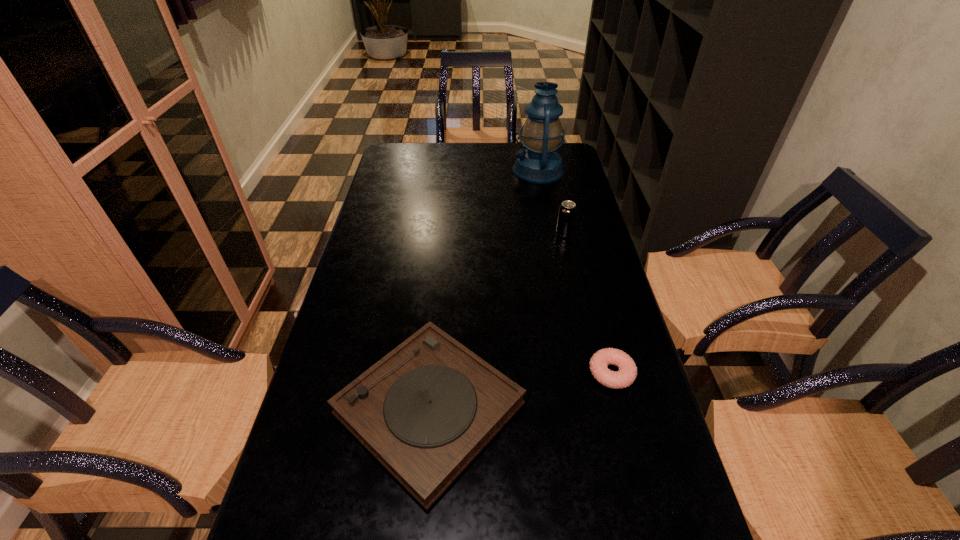
This screenshot has height=540, width=960. In the image, there is a desktop. What are the coordinates of `vacant space at the right edge` in the screenshot? It's located at (585, 245).

This screenshot has height=540, width=960. In the image, there is a desktop. Identify the location of vacant space at the far left corner. (385, 157).

Image resolution: width=960 pixels, height=540 pixels. What are the coordinates of `free space between the doughnut and the farthest object` in the screenshot? It's located at (575, 272).

Find the location of a particular element. free spot between the phonograph record and the third nearest object is located at coordinates (496, 321).

Identify the location of free space between the second shortest object and the third nearest object. (496, 321).

What are the coordinates of `vacant space that's between the second tallest object and the lantern` in the screenshot? It's located at (551, 202).

Locate an element on the screen. The width and height of the screenshot is (960, 540). blank region between the tallest object and the shortest object is located at coordinates (575, 272).

Identify the location of empty space that is in between the shortest object and the soda can. (588, 303).

Locate an element on the screen. The width and height of the screenshot is (960, 540). free spot between the third tallest object and the tallest object is located at coordinates (484, 289).

The width and height of the screenshot is (960, 540). What are the coordinates of `free space between the tallest object and the phonograph record` in the screenshot? It's located at (484, 289).